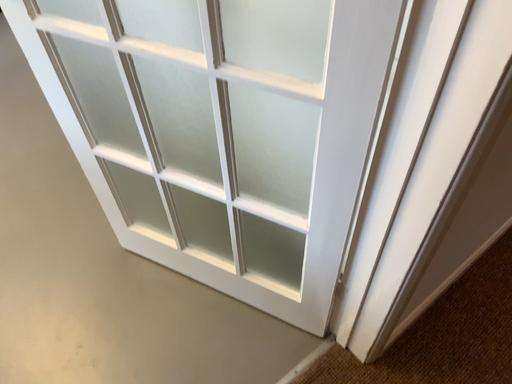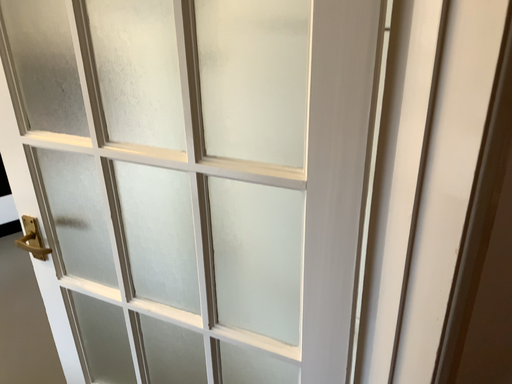
Question: Which way did the camera rotate in the video?

Choices:
 (A) rotated upward
 (B) rotated downward

Answer: (A)